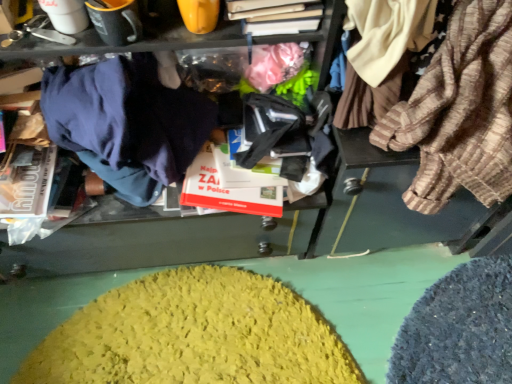
Question: Can you confirm if yellow fuzzy rug at lower center is smaller than dark blue fabric at left, the second clothing positioned from the right?

Choices:
 (A) no
 (B) yes

Answer: (B)

Question: Is yellow fuzzy rug at lower center facing towards dark blue fabric at left, the first clothing viewed from the left?

Choices:
 (A) no
 (B) yes

Answer: (A)

Question: Is the depth of yellow fuzzy rug at lower center less than that of dark blue fabric at left, the second clothing positioned from the right?

Choices:
 (A) no
 (B) yes

Answer: (A)

Question: From a real-world perspective, is yellow fuzzy rug at lower center under dark blue fabric at left, the first clothing viewed from the left?

Choices:
 (A) yes
 (B) no

Answer: (A)

Question: Is yellow fuzzy rug at lower center at the right side of dark blue fabric at left, the second clothing positioned from the right?

Choices:
 (A) no
 (B) yes

Answer: (B)

Question: Is yellow fuzzy rug at lower center wider than dark blue fabric at left, the second clothing positioned from the right?

Choices:
 (A) yes
 (B) no

Answer: (A)

Question: From a real-world perspective, is striped cotton shirt at right, which appears as the second clothing when viewed from the left, positioned under yellow fuzzy rug at lower center based on gravity?

Choices:
 (A) yes
 (B) no

Answer: (B)

Question: From the image's perspective, does striped cotton shirt at right, the 1th clothing when ordered from right to left, appear higher than yellow fuzzy rug at lower center?

Choices:
 (A) no
 (B) yes

Answer: (B)

Question: Is striped cotton shirt at right, the 1th clothing when ordered from right to left, next to yellow fuzzy rug at lower center?

Choices:
 (A) yes
 (B) no

Answer: (B)

Question: From the image's perspective, is striped cotton shirt at right, the 1th clothing when ordered from right to left, beneath yellow fuzzy rug at lower center?

Choices:
 (A) yes
 (B) no

Answer: (B)

Question: Is striped cotton shirt at right, the 1th clothing when ordered from right to left, turned away from yellow fuzzy rug at lower center?

Choices:
 (A) yes
 (B) no

Answer: (B)

Question: Does striped cotton shirt at right, the 1th clothing when ordered from right to left, appear on the left side of yellow fuzzy rug at lower center?

Choices:
 (A) no
 (B) yes

Answer: (A)

Question: Does striped cotton shirt at right, which appears as the second clothing when viewed from the left, have a lesser height compared to dark blue fabric at left, the first clothing viewed from the left?

Choices:
 (A) no
 (B) yes

Answer: (A)